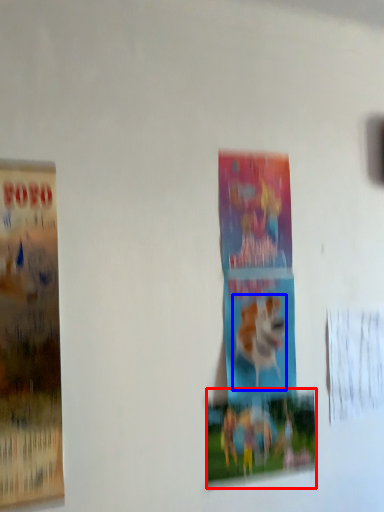
Question: Which of the following is the closest to the observer, poster (highlighted by a red box) or animal (highlighted by a blue box)?

Choices:
 (A) poster
 (B) animal

Answer: (A)